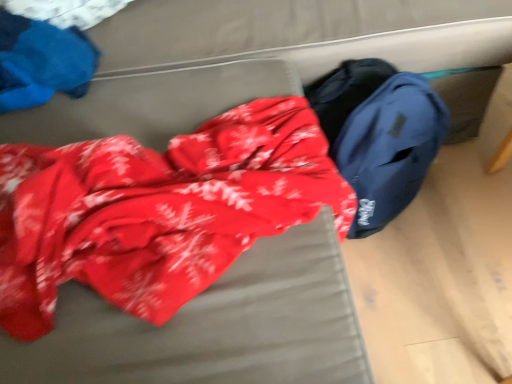
Looking at this image, in order to face matte blue blanket at upper left, should I rotate leftwards or rightwards?

To align with it, rotate left about 28.167°.

The width and height of the screenshot is (512, 384). What do you see at coordinates (42, 61) in the screenshot?
I see `matte blue blanket at upper left` at bounding box center [42, 61].

In order to click on matte blue blanket at upper left in this screenshot , I will do 42,61.

This screenshot has width=512, height=384. In order to click on matte blue blanket at upper left in this screenshot , I will do `click(42, 61)`.